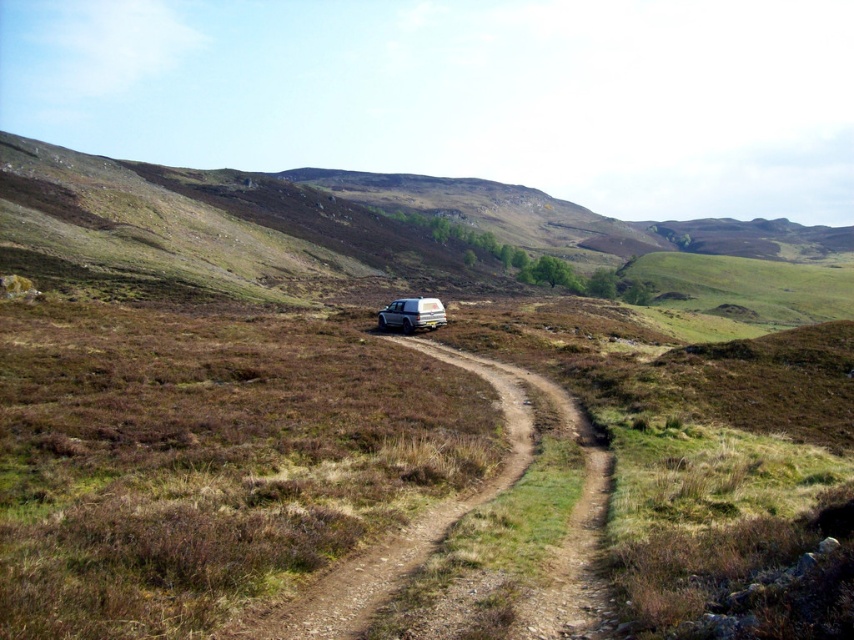
Between point (278, 614) and point (410, 317), which one is positioned behind?

The point (410, 317) is behind.

Can you confirm if brown dirt trail at center is shorter than silver metallic jeep at center?

Yes.

Between point (592, 449) and point (433, 317), which one is positioned behind?

The point (433, 317) is more distant.

Locate an element on the screen. brown dirt trail at center is located at coordinates (474, 513).